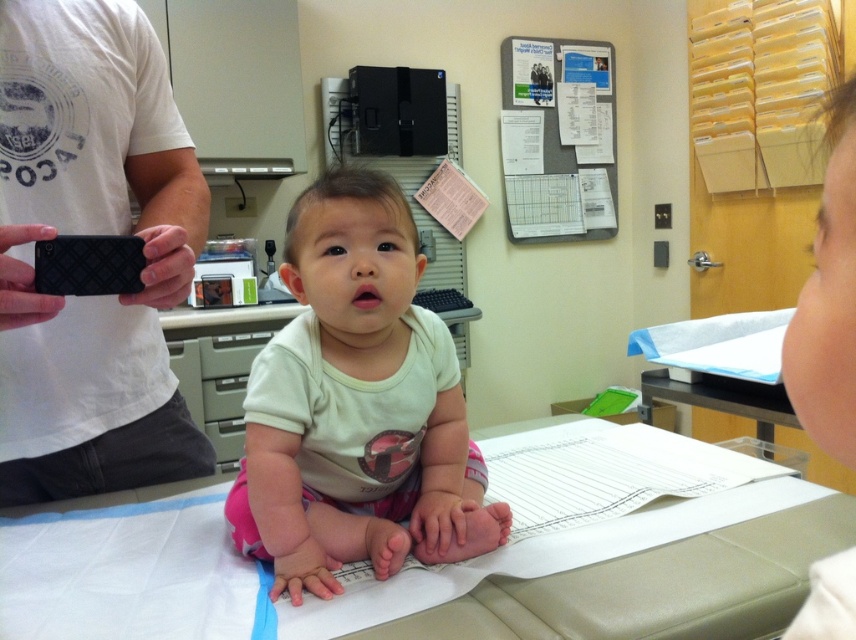
Question: Does black quilted phone at left come behind light green cotton shirt at center?

Choices:
 (A) no
 (B) yes

Answer: (A)

Question: Among these objects, which one is nearest to the camera?

Choices:
 (A) black quilted phone at left
 (B) light green cotton shirt at center

Answer: (A)

Question: Among these objects, which one is nearest to the camera?

Choices:
 (A) black quilted phone at left
 (B) light green cotton shirt at center

Answer: (A)

Question: Which of the following is the closest to the observer?

Choices:
 (A) pyautogui.click(x=302, y=337)
 (B) pyautogui.click(x=51, y=394)

Answer: (A)

Question: Is black quilted phone at left bigger than light green cotton shirt at center?

Choices:
 (A) yes
 (B) no

Answer: (A)

Question: Does black quilted phone at left have a greater width compared to light green cotton shirt at center?

Choices:
 (A) yes
 (B) no

Answer: (A)